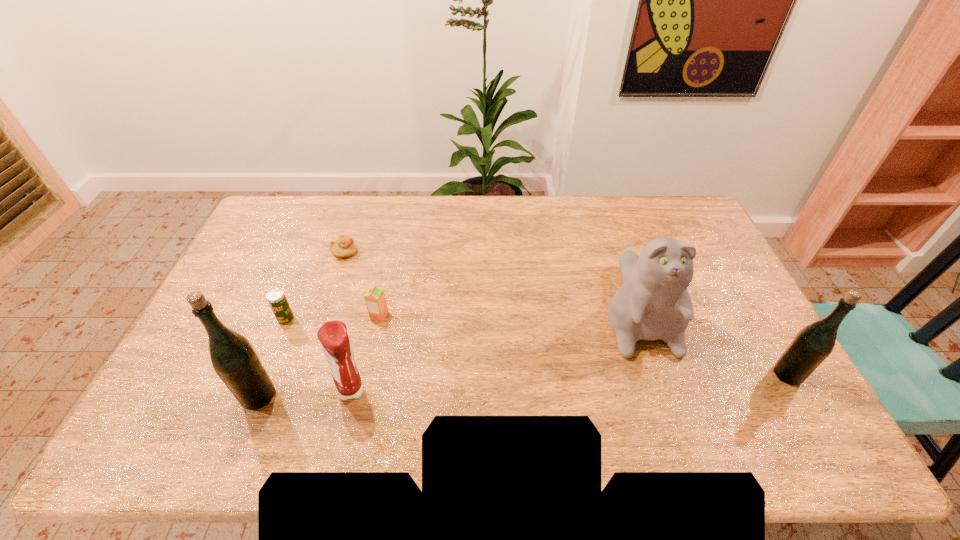
Locate an element on the screen. The width and height of the screenshot is (960, 540). vacant space located 0.080m on the right of the left beer bottle is located at coordinates (308, 396).

Identify the location of vacant region located on the back of the rightmost object. (770, 345).

Locate an element on the screen. free location located 0.180m on the front-facing side of the shortest object is located at coordinates (411, 252).

You are a GUI agent. You are given a task and a screenshot of the screen. Output one action in this format:
    pyautogui.click(x=<x>, y=<y>)
    Task: Click on the free point located on the face of the sixth object from left to right
    Image resolution: width=960 pixels, height=540 pixels.
    Given the screenshot: What is the action you would take?
    pyautogui.click(x=660, y=380)

Where is `vacant point located on the back of the orange juice`? This screenshot has height=540, width=960. vacant point located on the back of the orange juice is located at coordinates (391, 264).

Identify the location of free location located on the right of the beer can. The height and width of the screenshot is (540, 960). (345, 319).

Locate an element on the screen. The height and width of the screenshot is (540, 960). free space located 0.110m on the left of the condiment is located at coordinates (295, 390).

This screenshot has height=540, width=960. Identify the location of condiment that is at the near edge. (333, 336).

At what (x,y) coordinates should I click in order to perform the action: click on object that is at the right edge. Please return your answer as a coordinate pair (x, y). Looking at the image, I should click on pyautogui.click(x=814, y=343).

Where is `object located in the near right corner section of the desktop`? object located in the near right corner section of the desktop is located at coordinates (814, 343).